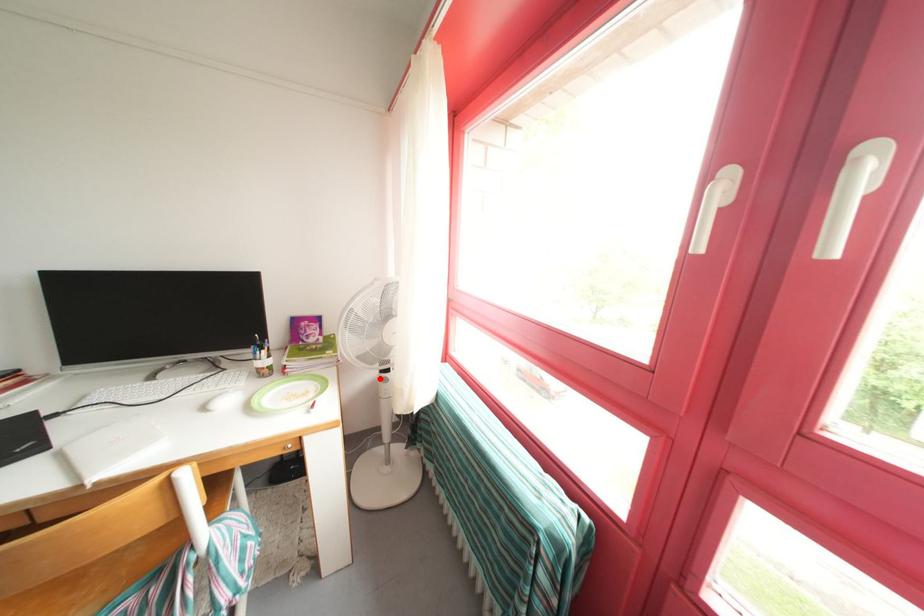
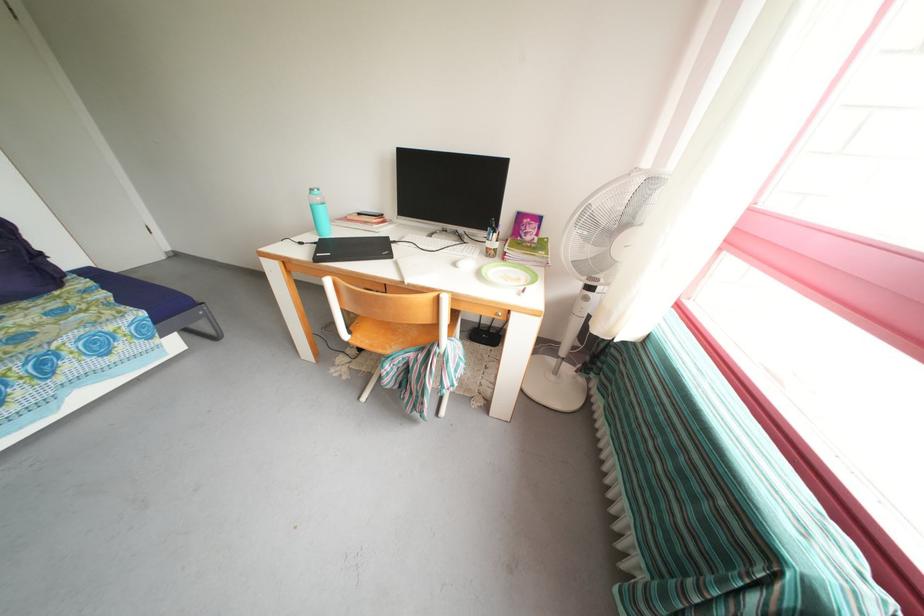
Find the pixel in the second image that matches the highlighted location in the first image.

(582, 293)